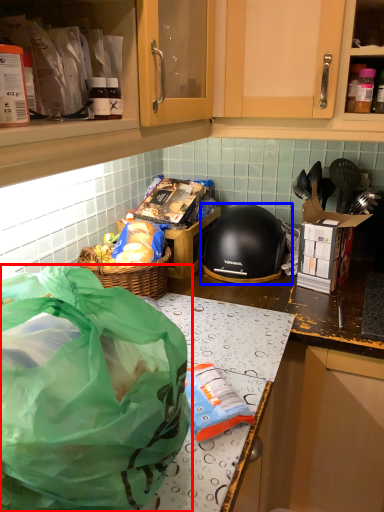
Question: Which object appears closest to the camera in this image, plastic bag (highlighted by a red box) or helmet (highlighted by a blue box)?

Choices:
 (A) plastic bag
 (B) helmet

Answer: (A)